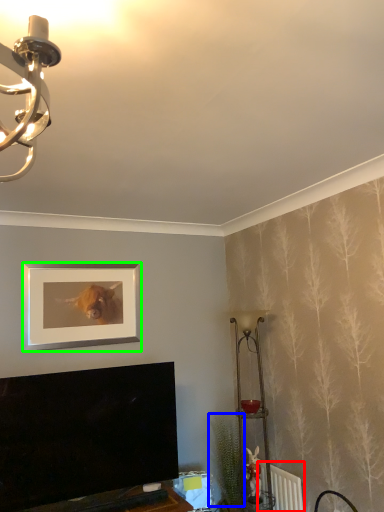
Question: Which is nearer to the radiator (highlighted by a red box)? plant (highlighted by a blue box) or picture frame (highlighted by a green box).

Choices:
 (A) plant
 (B) picture frame

Answer: (A)